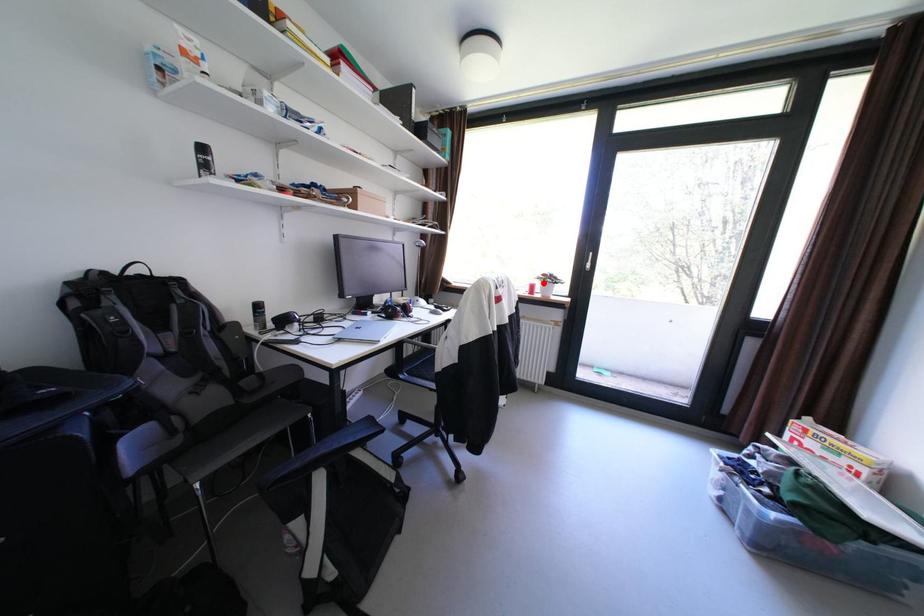
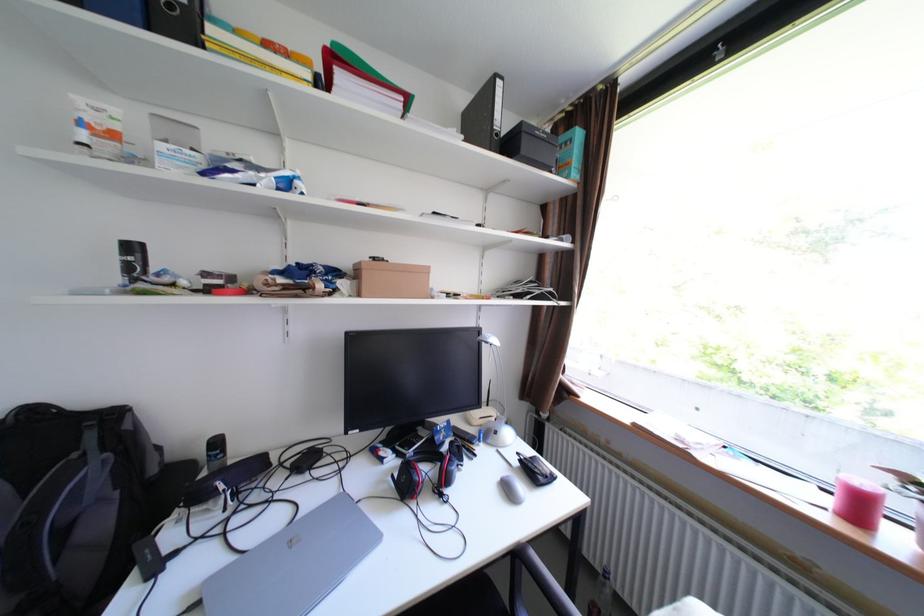
Question: I am providing you with two images of the same scene from different viewpoints. In image1, a red point is highlighted. Considering the same 3D point in image2, which of the following is correct?

Choices:
 (A) It is closer
 (B) It is farther

Answer: (B)